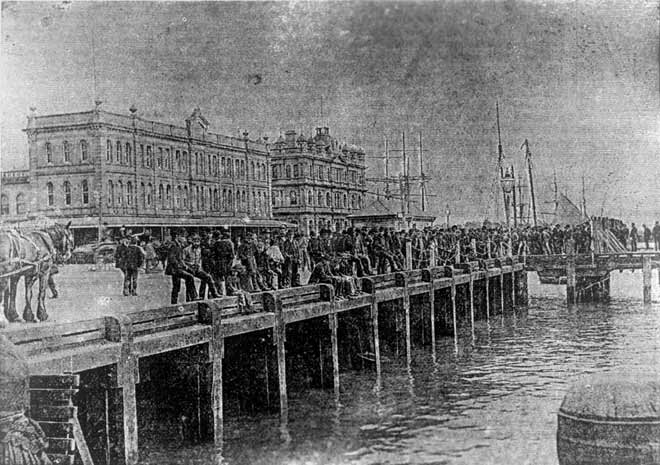
The image size is (660, 465). In order to click on column in this screenshot , I will do `click(214, 363)`.